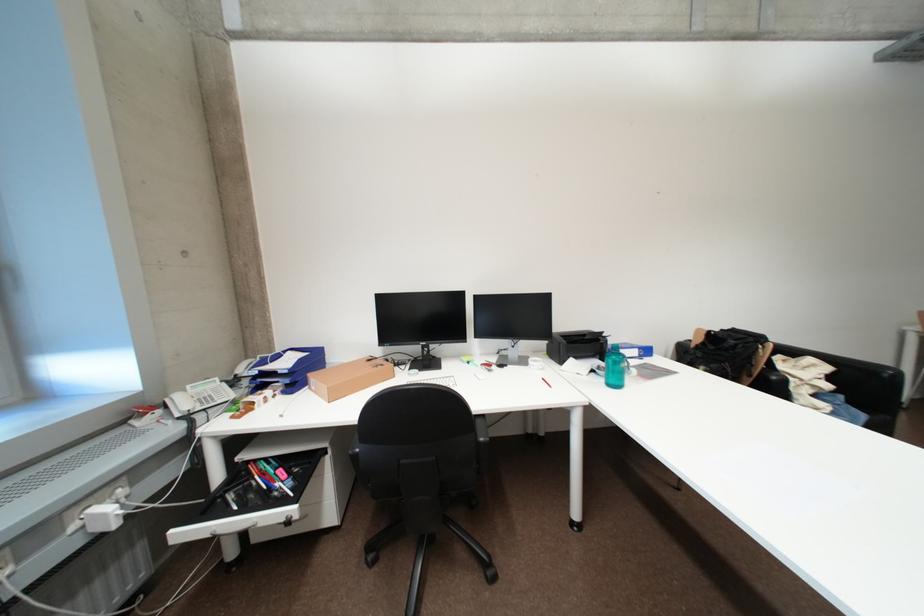
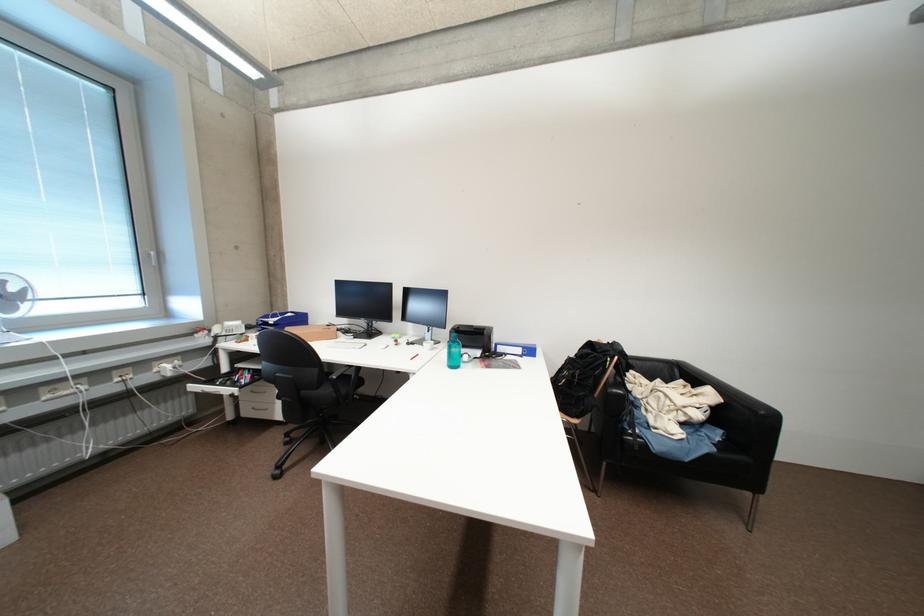
Locate, in the second image, the point that corresponds to the point at 300,512 in the first image.

(244, 392)